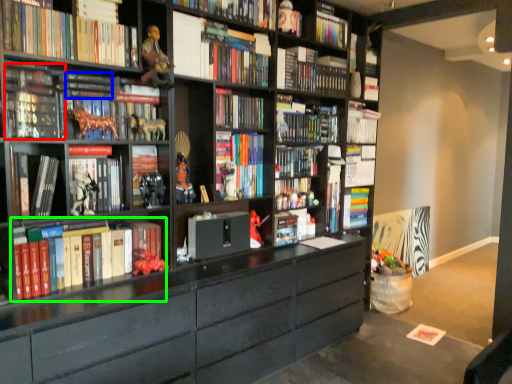
Question: Based on their relative distances, which object is farther from book (highlighted by a red box)? Choose from book (highlighted by a blue box) and book (highlighted by a green box).

Choices:
 (A) book
 (B) book

Answer: (B)